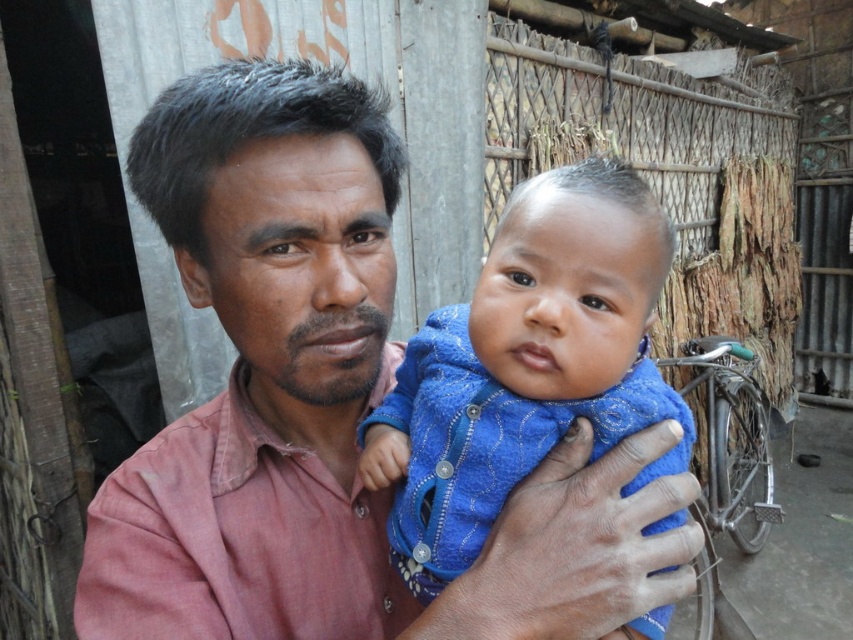
Consider the image. You are a photographer taking a portrait of the man and baby. You need to ensure that both the pink cotton shirt at center and the blue textured cloth at center are visible in the frame. Based on their positions, which object should you focus on first to ensure both are in focus?

The pink cotton shirt at center is located below the blue textured cloth at center. To ensure both are in focus, you should focus on the pink cotton shirt at center first since it is closer to the camera, allowing the blue textured cloth at center to remain in focus as well.

You are a photographer who needs to ensure that the pink cotton shirt at center and the blue textured cloth at center are both visible in the photo. Based on their positions, which one should you focus on to make sure both are in frame?

The pink cotton shirt at center is taller than the blue textured cloth at center, so focusing on the pink cotton shirt at center will ensure both are in frame since it occupies a larger vertical space.